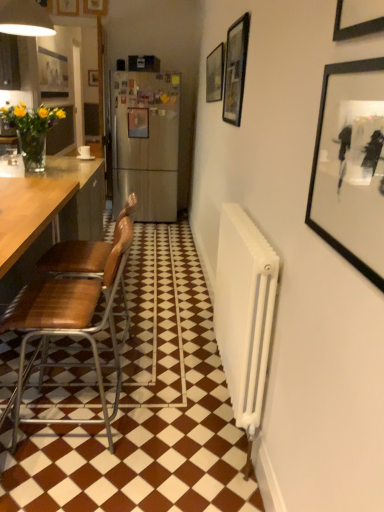
I want to click on vacant area that is situated to the right of brown leather chair at left, which is the second chair in back-to-front order, so click(x=176, y=439).